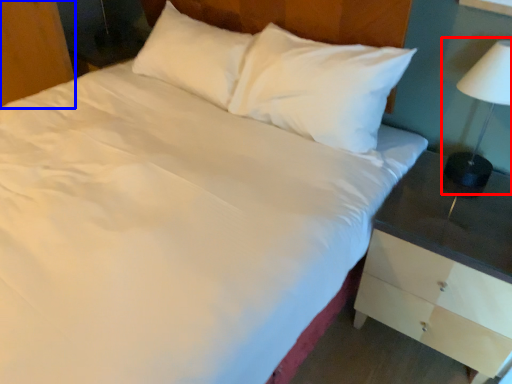
Question: Which of the following is the farthest to the observer, bedside lamp (highlighted by a red box) or dresser (highlighted by a blue box)?

Choices:
 (A) bedside lamp
 (B) dresser

Answer: (B)